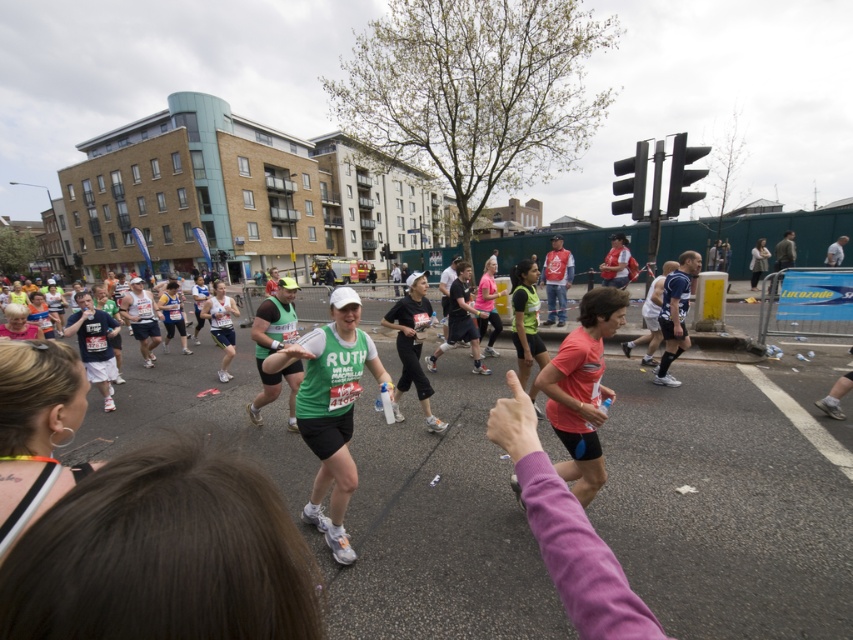
Question: Can you confirm if green matte shirt at center is thinner than matte pink shirt at center?

Choices:
 (A) yes
 (B) no

Answer: (B)

Question: Which is farther from the neon yellow hair at center?

Choices:
 (A) matte pink shirt at center
 (B) green fabric shirt at center
 (C) pink fabric shirt at center

Answer: (C)

Question: Which object is closer to the camera taking this photo?

Choices:
 (A) matte pink shirt at center
 (B) neon yellow hair at center
 (C) pink fabric shirt at center

Answer: (B)

Question: Among these points, which one is nearest to the camera?

Choices:
 (A) (384, 371)
 (B) (0, 424)
 (C) (550, 362)
 (D) (482, 308)

Answer: (B)

Question: Does matte pink shirt at center appear over green fabric shirt at center?

Choices:
 (A) yes
 (B) no

Answer: (B)

Question: Is matte pink shirt at center closer to the viewer compared to green fabric shirt at center?

Choices:
 (A) yes
 (B) no

Answer: (A)